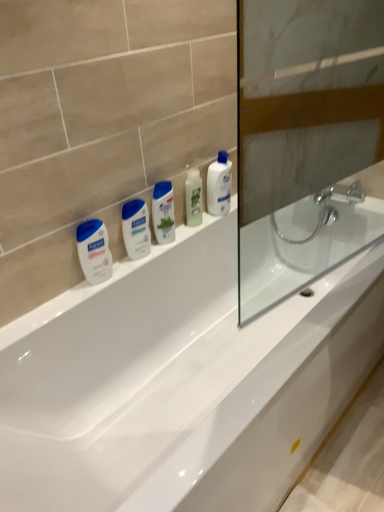
Find the location of a particular element. This screenshot has width=384, height=512. space that is in front of white glossy lotion at left, which is the fourth mouthwash in right-to-left order is located at coordinates (65, 305).